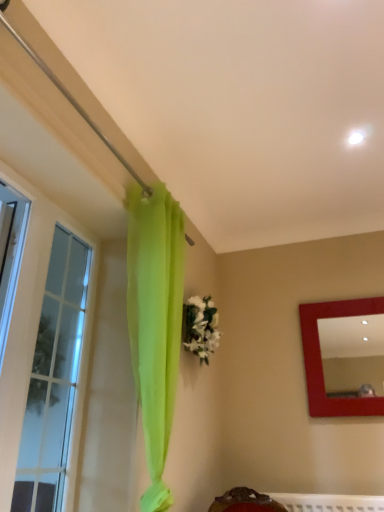
Question: Considering the relative positions of matte red mirror at upper right and clear glass window at left in the image provided, is matte red mirror at upper right behind clear glass window at left?

Choices:
 (A) yes
 (B) no

Answer: (A)

Question: Is matte red mirror at upper right positioned in front of clear glass window at left?

Choices:
 (A) yes
 (B) no

Answer: (B)

Question: Does matte red mirror at upper right have a greater width compared to clear glass window at left?

Choices:
 (A) no
 (B) yes

Answer: (B)

Question: Is matte red mirror at upper right not close to clear glass window at left?

Choices:
 (A) no
 (B) yes

Answer: (B)

Question: Is matte red mirror at upper right taller than clear glass window at left?

Choices:
 (A) no
 (B) yes

Answer: (A)

Question: Considering their positions, is white matte floral arrangement at center located in front of or behind clear glass window at left?

Choices:
 (A) behind
 (B) front

Answer: (A)

Question: From their relative heights in the image, would you say white matte floral arrangement at center is taller or shorter than clear glass window at left?

Choices:
 (A) short
 (B) tall

Answer: (A)

Question: From a real-world perspective, is white matte floral arrangement at center positioned above or below clear glass window at left?

Choices:
 (A) below
 (B) above

Answer: (B)

Question: Would you say white matte floral arrangement at center is to the left or to the right of clear glass window at left in the picture?

Choices:
 (A) right
 (B) left

Answer: (A)

Question: Is matte red mirror at upper right spatially inside clear glass window at left, or outside of it?

Choices:
 (A) outside
 (B) inside

Answer: (A)

Question: From the image's perspective, relative to clear glass window at left, is matte red mirror at upper right above or below?

Choices:
 (A) above
 (B) below

Answer: (B)

Question: In terms of height, does matte red mirror at upper right look taller or shorter compared to clear glass window at left?

Choices:
 (A) tall
 (B) short

Answer: (B)

Question: Considering the positions of matte red mirror at upper right and clear glass window at left in the image, is matte red mirror at upper right wider or thinner than clear glass window at left?

Choices:
 (A) wide
 (B) thin

Answer: (A)

Question: Considering the positions of point (201, 344) and point (340, 327), is point (201, 344) closer or farther from the camera than point (340, 327)?

Choices:
 (A) closer
 (B) farther

Answer: (A)

Question: Based on their sizes in the image, would you say white matte floral arrangement at center is bigger or smaller than matte red mirror at upper right?

Choices:
 (A) small
 (B) big

Answer: (A)